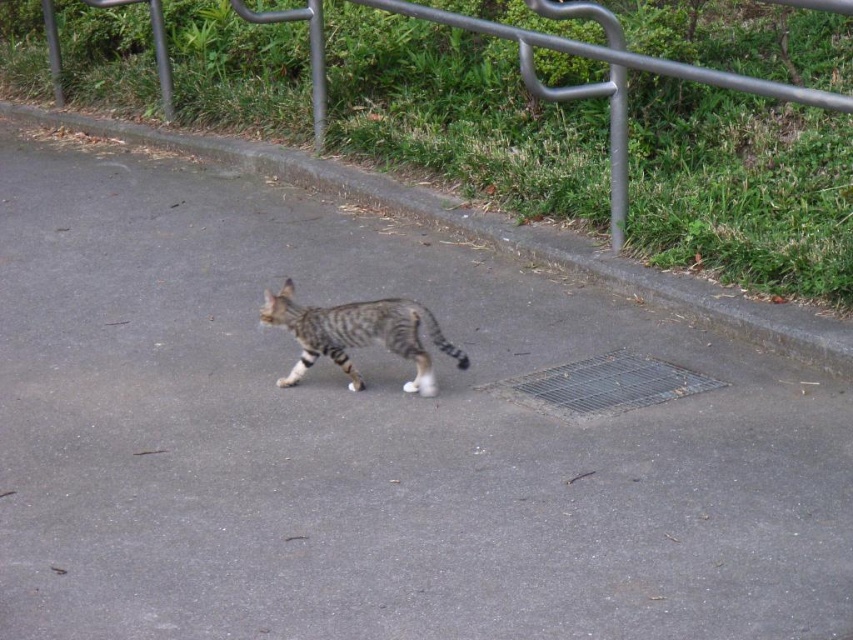
The image size is (853, 640). What do you see at coordinates (608, 77) in the screenshot?
I see `brushed metal fence at upper center` at bounding box center [608, 77].

Is brushed metal fence at upper center positioned at the back of striped fur cat at center?

Yes, it is.

I want to click on brushed metal fence at upper center, so click(608, 77).

The height and width of the screenshot is (640, 853). In order to click on brushed metal fence at upper center in this screenshot , I will do `click(608, 77)`.